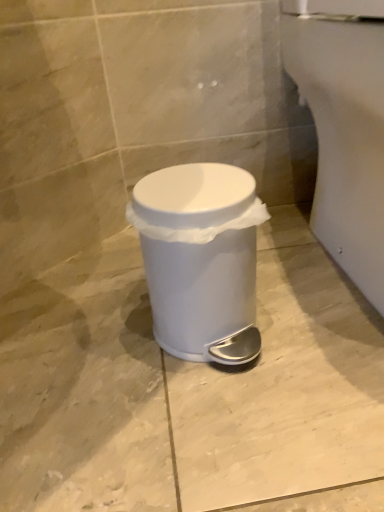
You are a GUI agent. You are given a task and a screenshot of the screen. Output one action in this format:
    pyautogui.click(x=<x>, y=<y>)
    Task: Click on the free space above white plastic waste container at center (from a real-world perspective)
    The image size is (384, 512).
    Given the screenshot: What is the action you would take?
    pyautogui.click(x=205, y=182)